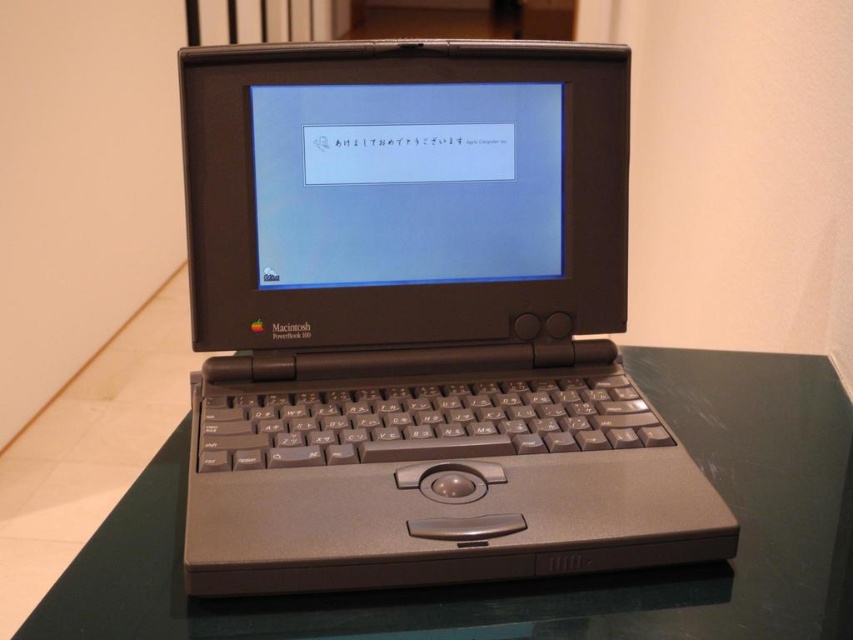
Question: Based on their relative distances, which object is farther from the matte black laptop at center?

Choices:
 (A) transparent glass table at center
 (B) matte plastic screen at center

Answer: (A)

Question: Can you confirm if matte black laptop at center is positioned to the left of transparent glass table at center?

Choices:
 (A) no
 (B) yes

Answer: (B)

Question: Does matte black laptop at center appear under transparent glass table at center?

Choices:
 (A) yes
 (B) no

Answer: (B)

Question: Which object is positioned farthest from the transparent glass table at center?

Choices:
 (A) matte black laptop at center
 (B) matte plastic screen at center

Answer: (B)

Question: Which point appears farthest from the camera in this image?

Choices:
 (A) (543, 179)
 (B) (515, 280)
 (C) (120, 520)

Answer: (B)

Question: Is transparent glass table at center to the left of matte plastic screen at center from the viewer's perspective?

Choices:
 (A) no
 (B) yes

Answer: (A)